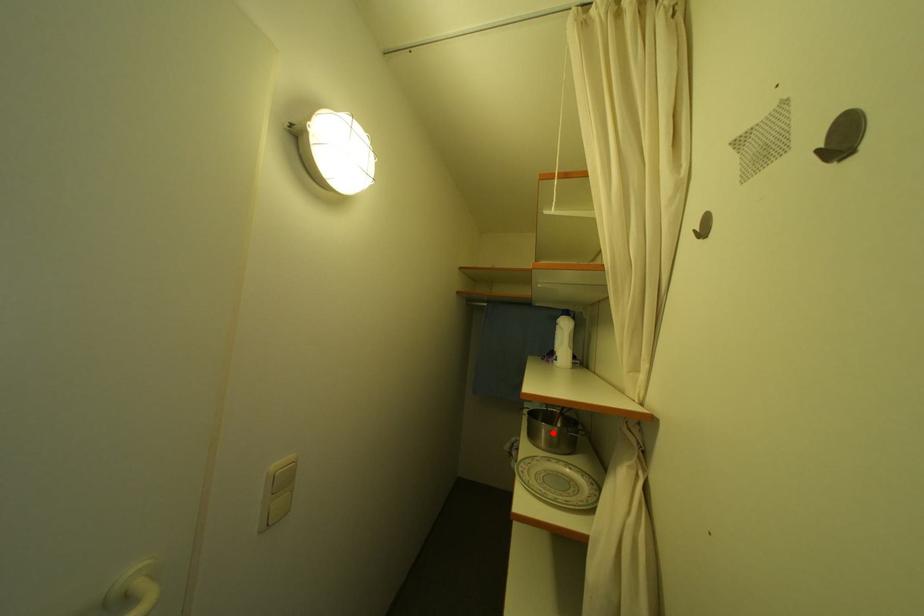
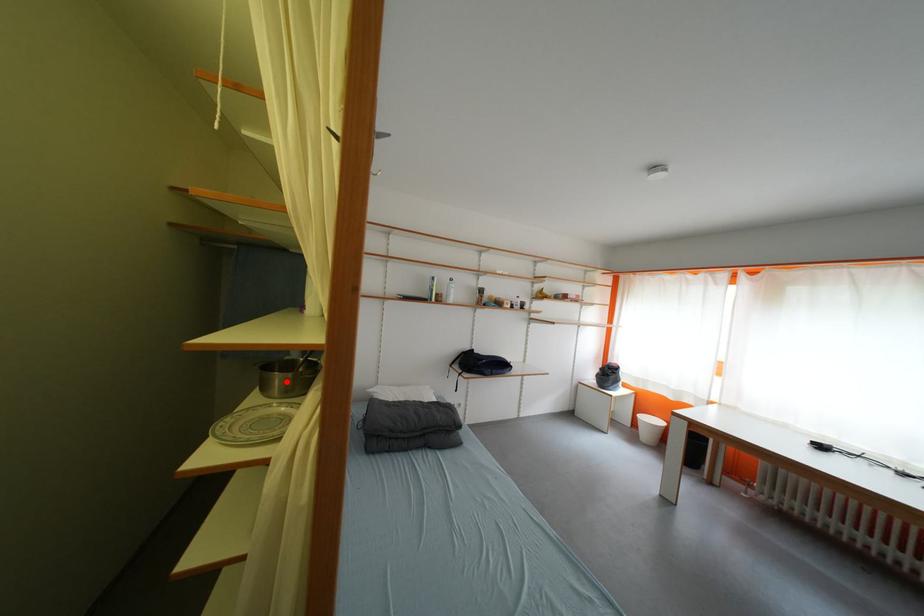
I am providing you with two images of the same scene from different viewpoints. A red point is marked on the first image and another point is marked on the second image. Is the marked point in image1 the same physical position as the marked point in image2?

Yes